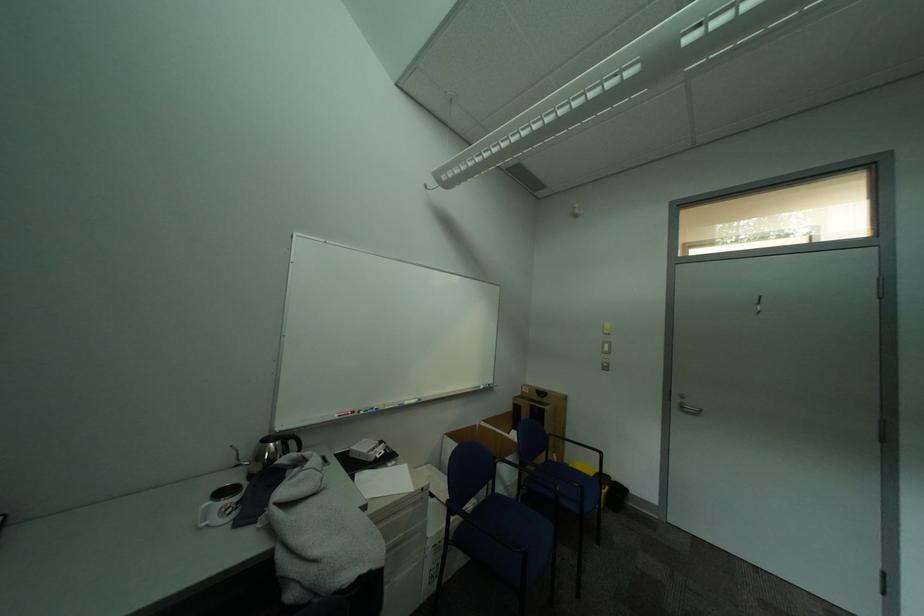
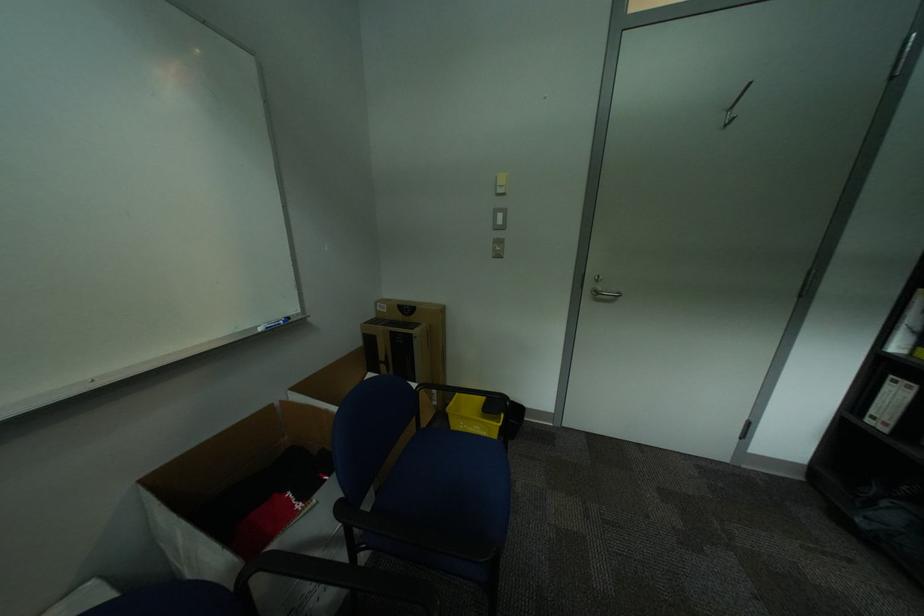
The point at (691, 408) is marked in the first image. Where is the corresponding point in the second image?

(606, 294)